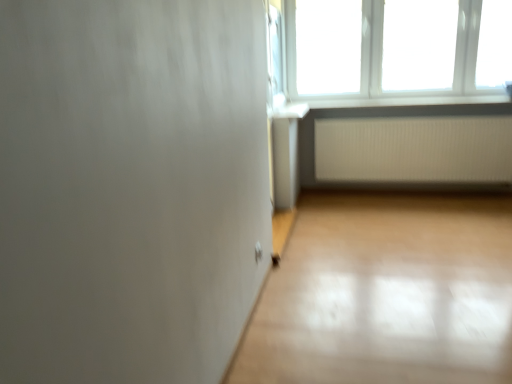
Question: From a real-world perspective, is white plastic window at upper right located higher than white plastic window sill at upper right?

Choices:
 (A) no
 (B) yes

Answer: (B)

Question: Is white plastic window at upper right further to camera compared to white plastic window sill at upper right?

Choices:
 (A) yes
 (B) no

Answer: (B)

Question: Considering the relative sizes of white plastic window at upper right and white plastic window sill at upper right in the image provided, is white plastic window at upper right wider than white plastic window sill at upper right?

Choices:
 (A) no
 (B) yes

Answer: (A)

Question: From the image's perspective, is white plastic window at upper right located above white plastic window sill at upper right?

Choices:
 (A) yes
 (B) no

Answer: (A)

Question: From a real-world perspective, is white plastic window at upper right located beneath white plastic window sill at upper right?

Choices:
 (A) no
 (B) yes

Answer: (A)

Question: From a real-world perspective, is white plastic window sill at upper right above or below white ribbed radiator at lower right?

Choices:
 (A) above
 (B) below

Answer: (A)

Question: Based on their sizes in the image, would you say white plastic window sill at upper right is bigger or smaller than white ribbed radiator at lower right?

Choices:
 (A) small
 (B) big

Answer: (A)

Question: Which is correct: white plastic window sill at upper right is inside white ribbed radiator at lower right, or outside of it?

Choices:
 (A) inside
 (B) outside

Answer: (B)

Question: Considering the positions of white plastic window sill at upper right and white ribbed radiator at lower right in the image, is white plastic window sill at upper right taller or shorter than white ribbed radiator at lower right?

Choices:
 (A) short
 (B) tall

Answer: (A)

Question: In terms of width, does white plastic window at upper right look wider or thinner when compared to white ribbed radiator at lower right?

Choices:
 (A) thin
 (B) wide

Answer: (B)

Question: Considering the positions of point (420, 9) and point (352, 148), is point (420, 9) closer or farther from the camera than point (352, 148)?

Choices:
 (A) farther
 (B) closer

Answer: (B)

Question: From the image's perspective, is white plastic window at upper right positioned above or below white ribbed radiator at lower right?

Choices:
 (A) above
 (B) below

Answer: (A)

Question: Relative to white ribbed radiator at lower right, is white plastic window at upper right in front or behind?

Choices:
 (A) behind
 (B) front

Answer: (B)

Question: From the image's perspective, is white plastic window at upper right above or below white plastic window sill at upper right?

Choices:
 (A) below
 (B) above

Answer: (B)

Question: Considering the relative positions of white plastic window at upper right and white plastic window sill at upper right in the image provided, is white plastic window at upper right to the left or to the right of white plastic window sill at upper right?

Choices:
 (A) right
 (B) left

Answer: (B)